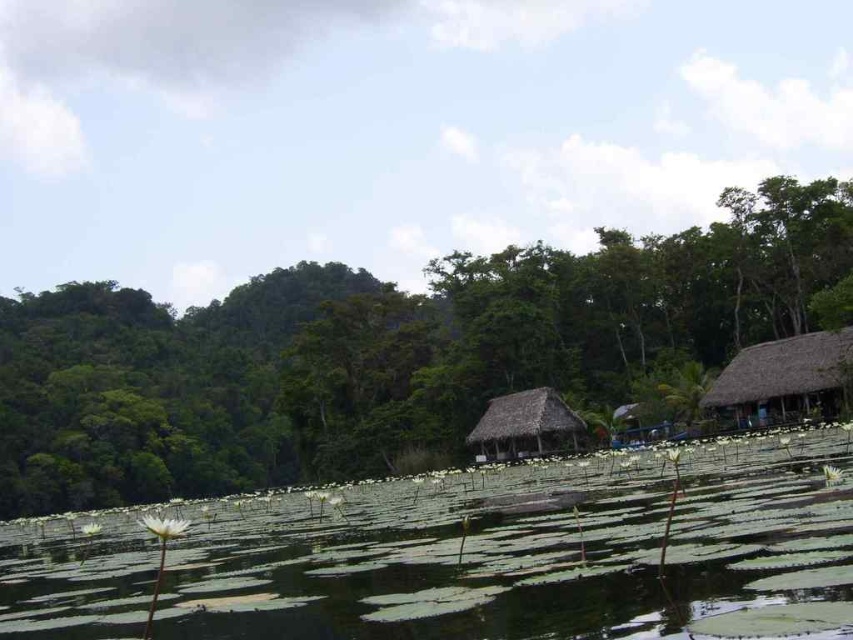
This screenshot has width=853, height=640. What do you see at coordinates (386, 353) in the screenshot?
I see `green leafy tree at center` at bounding box center [386, 353].

Does green leafy tree at center have a smaller size compared to thatched straw hut at center?

Actually, green leafy tree at center might be larger than thatched straw hut at center.

Is point (347, 384) positioned in front of point (520, 394)?

No, (347, 384) is behind (520, 394).

In order to click on green leafy tree at center in this screenshot , I will do `click(386, 353)`.

Can you confirm if green leafy water at center is bigger than thatched straw hut at center?

Indeed, green leafy water at center has a larger size compared to thatched straw hut at center.

Does green leafy water at center have a lesser width compared to thatched straw hut at center?

Incorrect, green leafy water at center's width is not less than thatched straw hut at center's.

I want to click on green leafy water at center, so click(x=471, y=556).

Is green leafy water at center closer to camera compared to thatched brown hut at right?

Yes, green leafy water at center is closer to the viewer.

Which is more to the left, green leafy water at center or thatched brown hut at right?

green leafy water at center

Which is in front, point (77, 634) or point (770, 397)?

Positioned in front is point (77, 634).

At what (x,y) coordinates should I click in order to perform the action: click on green leafy water at center. Please return your answer as a coordinate pair (x, y). This screenshot has width=853, height=640. Looking at the image, I should click on (471, 556).